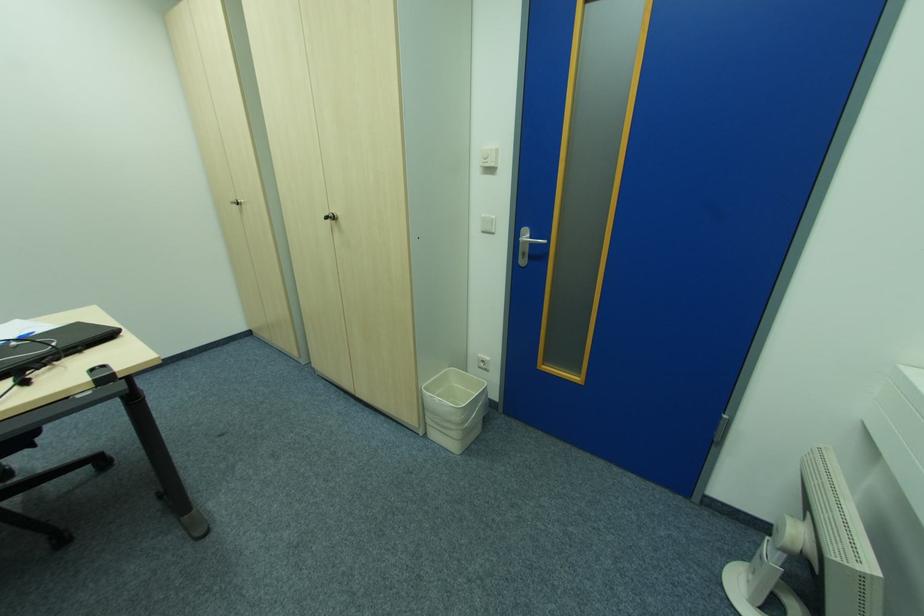
Describe the element at coordinates (489, 156) in the screenshot. I see `the white light switch` at that location.